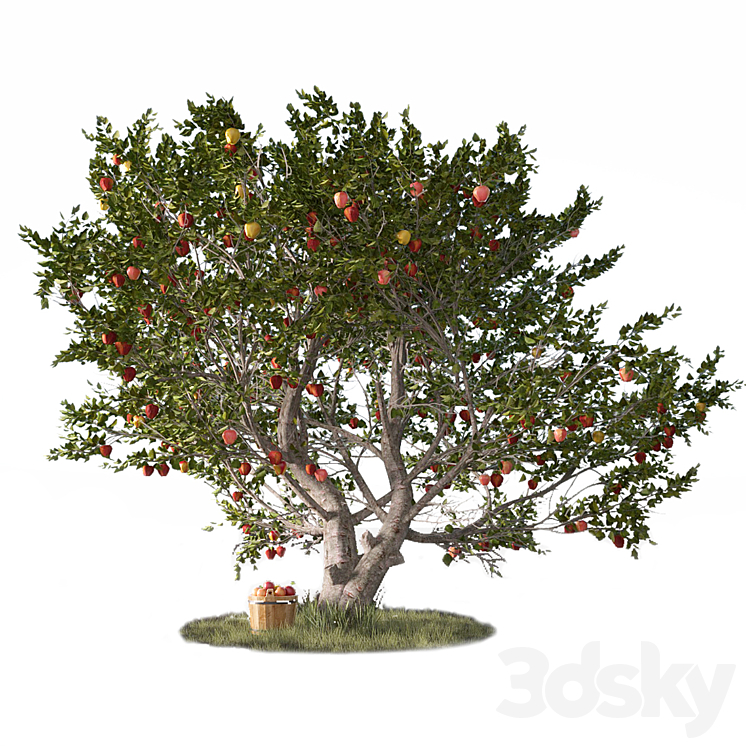
Locate an element on the screen. This screenshot has height=746, width=746. basket is located at coordinates (274, 617).